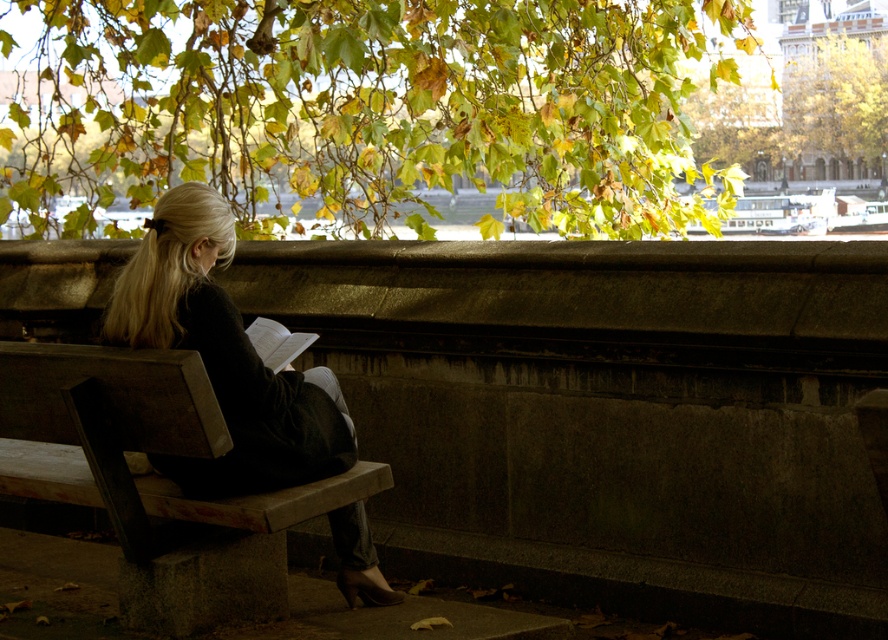
You are a photographer planning to take a picture of the wooden bench at center and the green leafy tree at upper center. Based on their positions, which object should you focus on first if you want to capture both in a single frame without moving the camera?

The wooden bench at center is positioned on the left side of the green leafy tree at upper center, so you should focus on the green leafy tree at upper center first to ensure both are in frame.

You are standing in the autumn park and want to sit on the wooden bench at center. However, there is a black fabric jacket at left on it. Can you sit there without moving the jacket?

The wooden bench at center is closer to the viewer than the black fabric jacket at left, meaning the jacket is not on the bench. Therefore, you can sit there without moving anything.

You are a photographer trying to capture a clear shot of the green leafy tree at upper center without any obstructions. The black fabric jacket at left is currently blocking your view. Can you move the jacket to get an unobstructed view of the tree?

The black fabric jacket at left is in front of the green leafy tree at upper center, so moving the jacket would allow you to see the tree without obstruction.